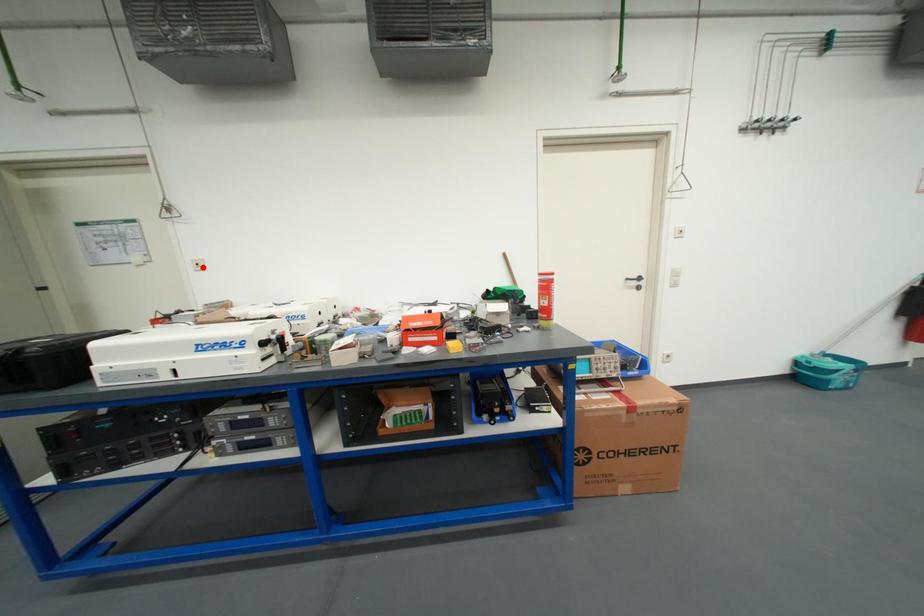
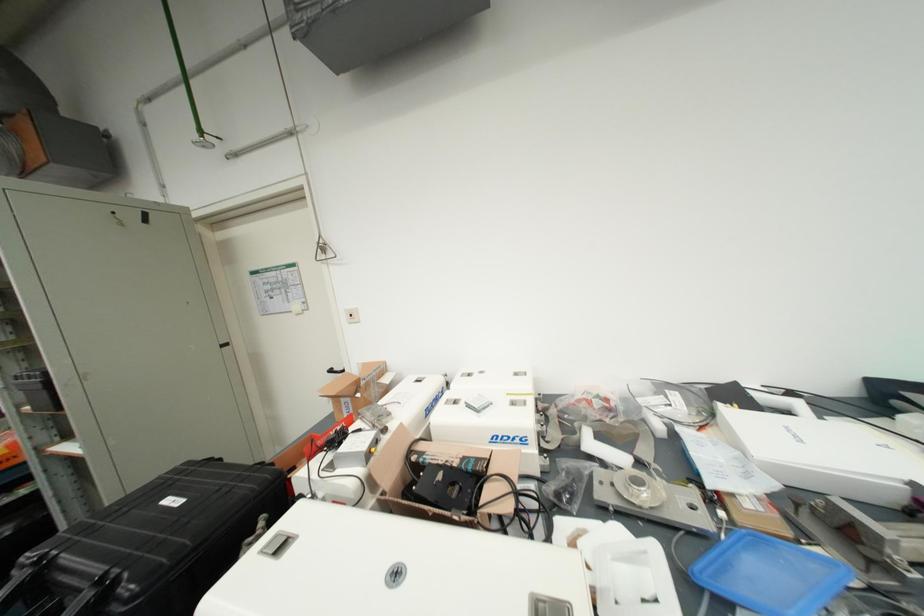
In the second image, find the point that corresponds to the highlighted location in the first image.

(357, 318)